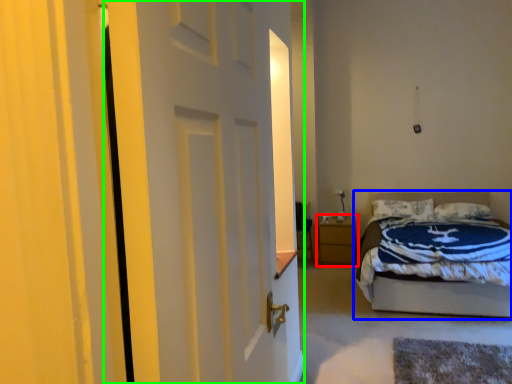
Question: Which object is the closest to the nightstand (highlighted by a red box)? Choose among these: bed (highlighted by a blue box) or door (highlighted by a green box).

Choices:
 (A) bed
 (B) door

Answer: (A)